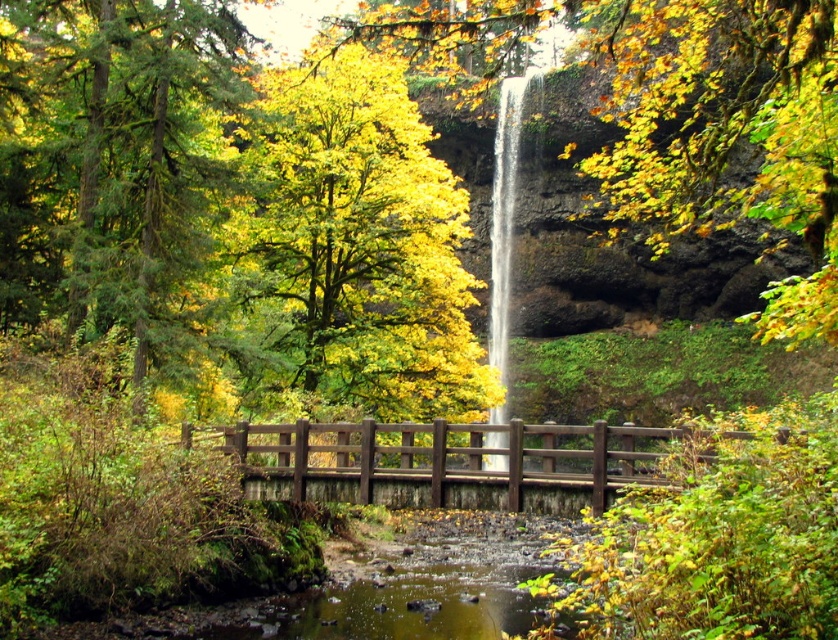
You are a hiker standing on the wooden bridge spanning the stream. You notice a yellow leafy tree at center and a white smooth waterfall at center. Which object is wider from your perspective?

The yellow leafy tree at center is wider than the white smooth waterfall at center according to the description.

You are standing at the wooden bridge spanning the stream and want to take a photo of the yellow leafy tree at center. Which direction should you face to capture the tree in your view?

The yellow leafy tree at center is located at point (676,115), so you should face towards the center area to capture it in your view.